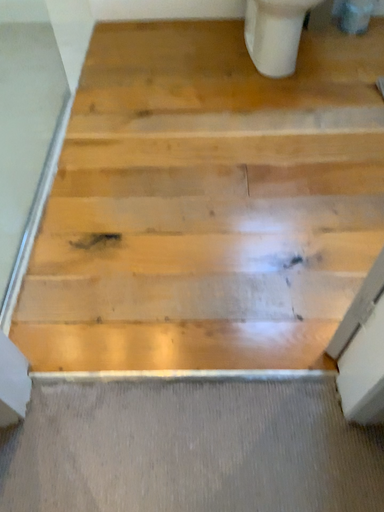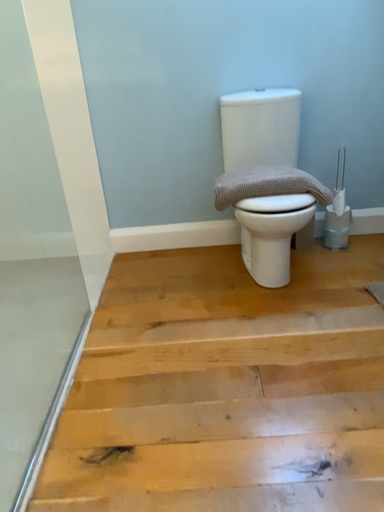
Question: How did the camera likely rotate when shooting the video?

Choices:
 (A) rotated downward
 (B) rotated upward

Answer: (B)